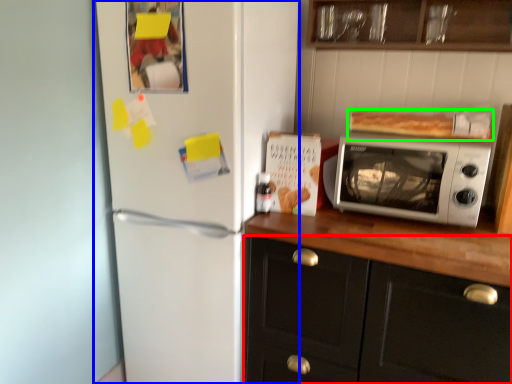
Question: Considering the real-world distances, which object is closest to cabinetry (highlighted by a red box)? refrigerator (highlighted by a blue box) or food (highlighted by a green box).

Choices:
 (A) refrigerator
 (B) food

Answer: (A)